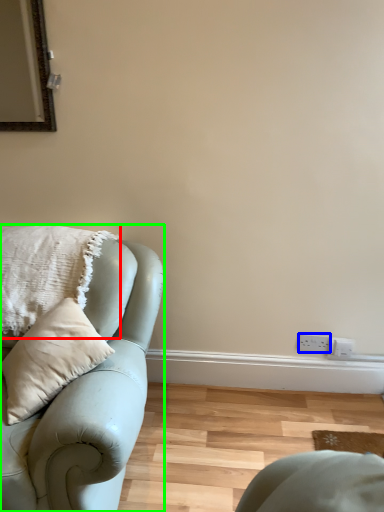
Question: Considering the real-world distances, which object is farthest from pillow (highlighted by a red box)? electric outlet (highlighted by a blue box) or studio couch (highlighted by a green box)?

Choices:
 (A) electric outlet
 (B) studio couch

Answer: (A)